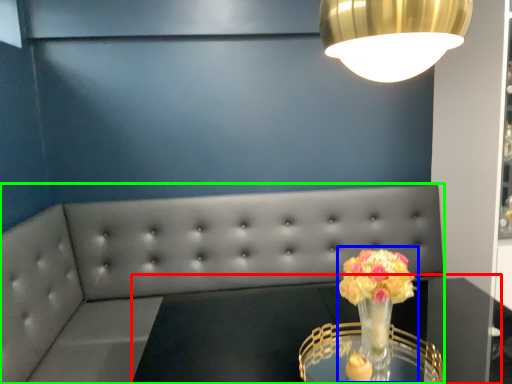
Question: Considering the real-world distances, which object is farthest from round table (highlighted by a red box)? floral arrangement (highlighted by a blue box) or studio couch (highlighted by a green box)?

Choices:
 (A) floral arrangement
 (B) studio couch

Answer: (B)